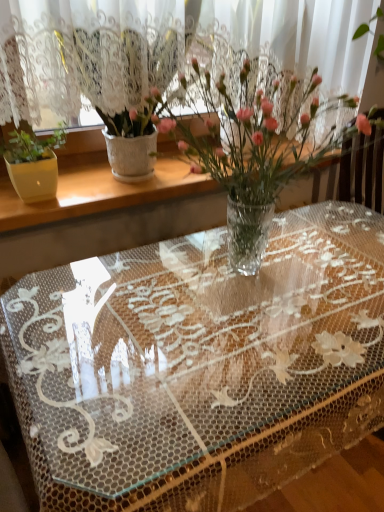
Question: Is white textured vase at upper left positioned behind clear plastic vase at center, positioned as the first houseplant in right-to-left order?

Choices:
 (A) yes
 (B) no

Answer: (A)

Question: Can you confirm if white textured vase at upper left is wider than clear plastic vase at center, positioned as the first houseplant in right-to-left order?

Choices:
 (A) no
 (B) yes

Answer: (A)

Question: From a real-world perspective, is white textured vase at upper left on top of clear plastic vase at center, positioned as the first houseplant in right-to-left order?

Choices:
 (A) no
 (B) yes

Answer: (A)

Question: Is white textured vase at upper left outside of clear plastic vase at center, the 2th houseplant viewed from the left?

Choices:
 (A) no
 (B) yes

Answer: (B)

Question: Is white textured vase at upper left taller than clear plastic vase at center, positioned as the first houseplant in right-to-left order?

Choices:
 (A) no
 (B) yes

Answer: (A)

Question: Considering the positions of point 79,198 and point 231,186, is point 79,198 closer or farther from the camera than point 231,186?

Choices:
 (A) closer
 (B) farther

Answer: (B)

Question: Is white textured vase at upper left spatially inside clear plastic vase at center, positioned as the first houseplant in right-to-left order, or outside of it?

Choices:
 (A) outside
 (B) inside

Answer: (A)

Question: Is white textured vase at upper left in front of or behind clear plastic vase at center, the 2th houseplant viewed from the left, in the image?

Choices:
 (A) front
 (B) behind

Answer: (B)

Question: From their relative heights in the image, would you say white textured vase at upper left is taller or shorter than clear plastic vase at center, the 2th houseplant viewed from the left?

Choices:
 (A) short
 (B) tall

Answer: (A)

Question: Is clear plastic vase at center, positioned as the first houseplant in right-to-left order, spatially inside white textured pot at left, which ranks as the 2th houseplant in right-to-left order, or outside of it?

Choices:
 (A) outside
 (B) inside

Answer: (A)

Question: From a real-world perspective, is clear plastic vase at center, the 2th houseplant viewed from the left, positioned above or below white textured pot at left, which ranks as the 2th houseplant in right-to-left order?

Choices:
 (A) below
 (B) above

Answer: (A)

Question: Relative to white textured pot at left, positioned as the first houseplant in left-to-right order, is clear plastic vase at center, positioned as the first houseplant in right-to-left order, in front or behind?

Choices:
 (A) behind
 (B) front

Answer: (B)

Question: Looking at their shapes, would you say clear plastic vase at center, the 2th houseplant viewed from the left, is wider or thinner than white textured pot at left, positioned as the first houseplant in left-to-right order?

Choices:
 (A) thin
 (B) wide

Answer: (B)

Question: From the image's perspective, is white textured pot at left, which ranks as the 2th houseplant in right-to-left order, positioned above or below clear plastic vase at center, the 2th houseplant viewed from the left?

Choices:
 (A) below
 (B) above

Answer: (B)

Question: Which is correct: white textured pot at left, which ranks as the 2th houseplant in right-to-left order, is inside clear plastic vase at center, the 2th houseplant viewed from the left, or outside of it?

Choices:
 (A) outside
 (B) inside

Answer: (A)